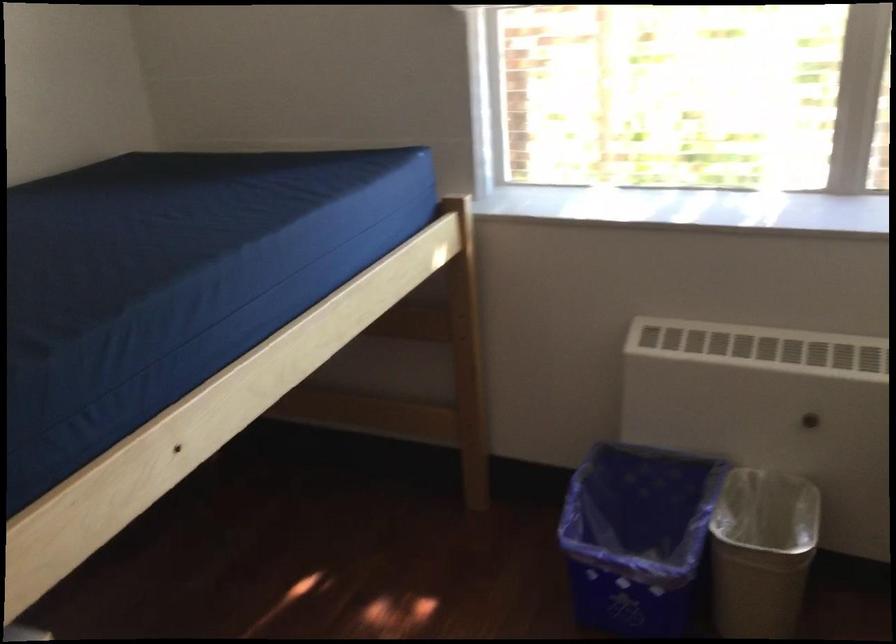
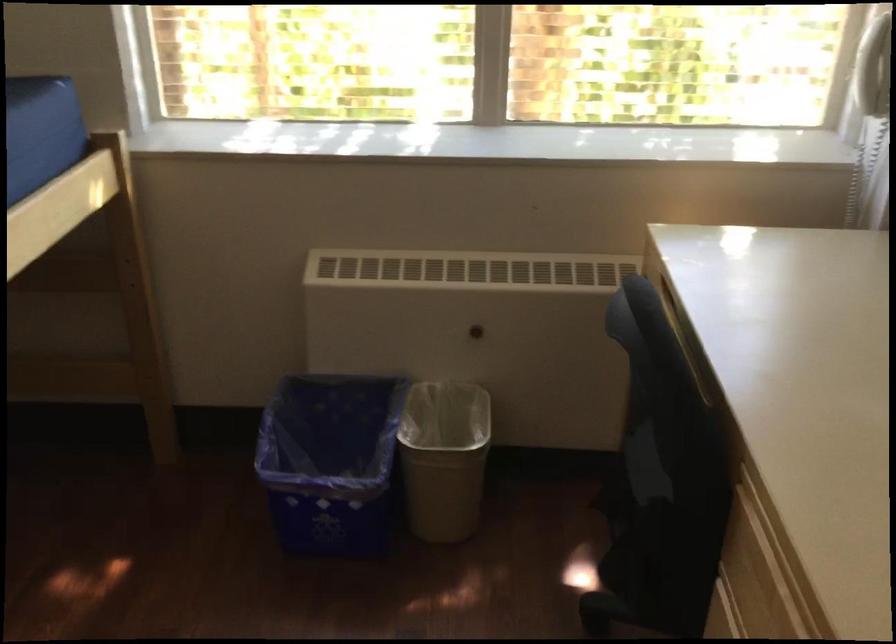
Locate, in the second image, the point that corresponds to point (762, 556) in the first image.

(444, 458)